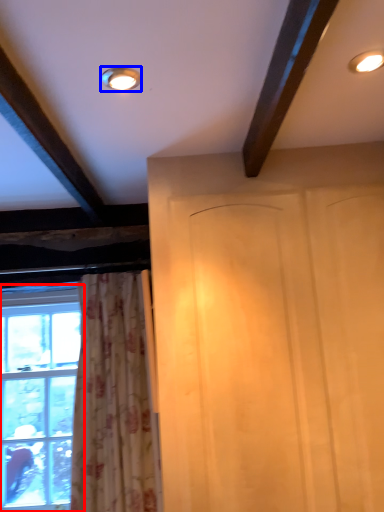
Question: Which of the following is the farthest to the observer, window (highlighted by a red box) or lighting (highlighted by a blue box)?

Choices:
 (A) window
 (B) lighting

Answer: (A)